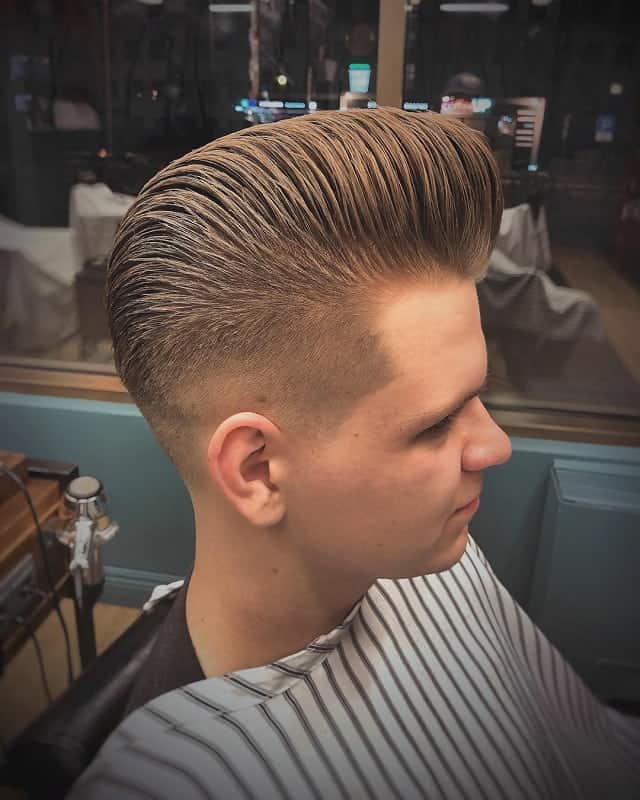
I want to click on silver blowdryer, so click(x=99, y=518).